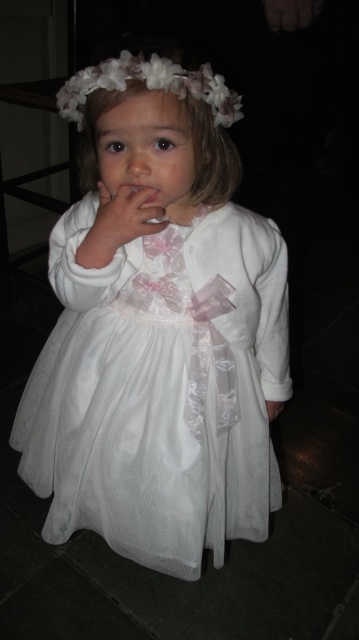
You are a photographer adjusting the lighting for a photo shoot. You notice the matte white hand at center and the white satin hand at lower center in the image. Which hand should you adjust the light towards to ensure both are equally visible?

The matte white hand at center should be adjusted towards the white satin hand at lower center because it is positioned to the left of it, and adjusting the light towards the left would help balance their visibility.

You are a photographer adjusting the lighting for a portrait. You notice the matte white hand at center and the white satin hand at lower center in the image. Which hand should you focus on to ensure proper exposure, considering their positions?

The matte white hand at center is in front of the white satin hand at lower center, so focusing on the matte white hand at center would ensure proper exposure since it is closer to the camera.